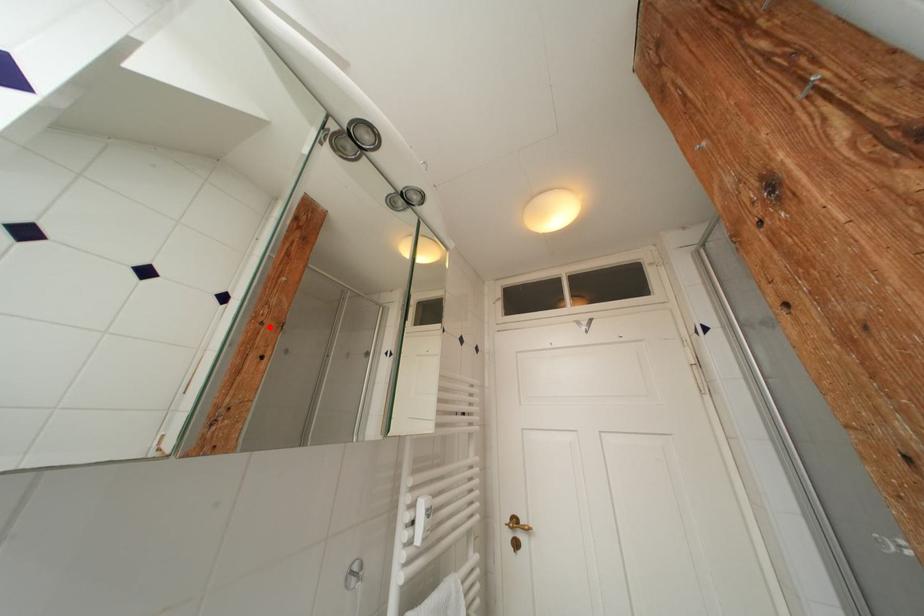
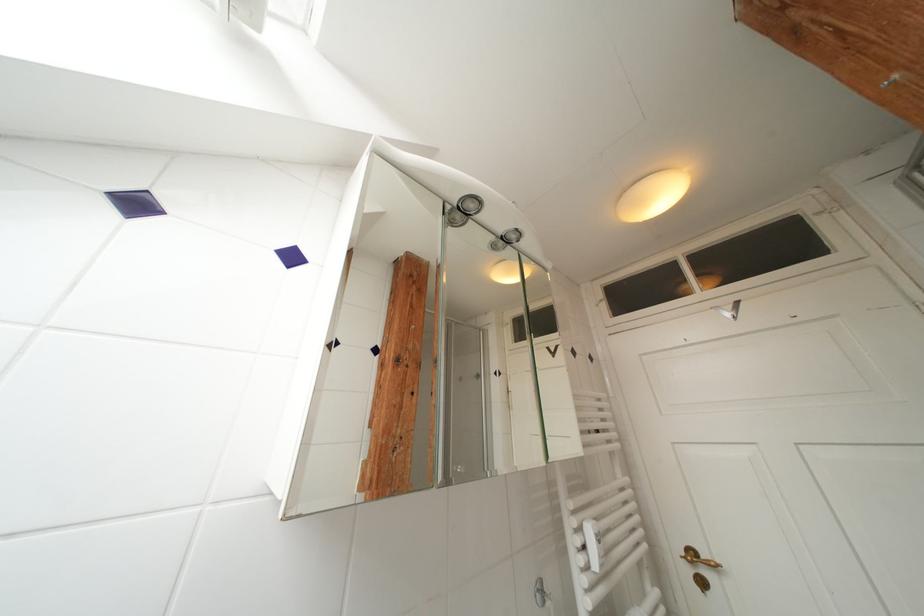
Where in the second image is the point corresponding to the highlighted location from the first image?

(412, 370)